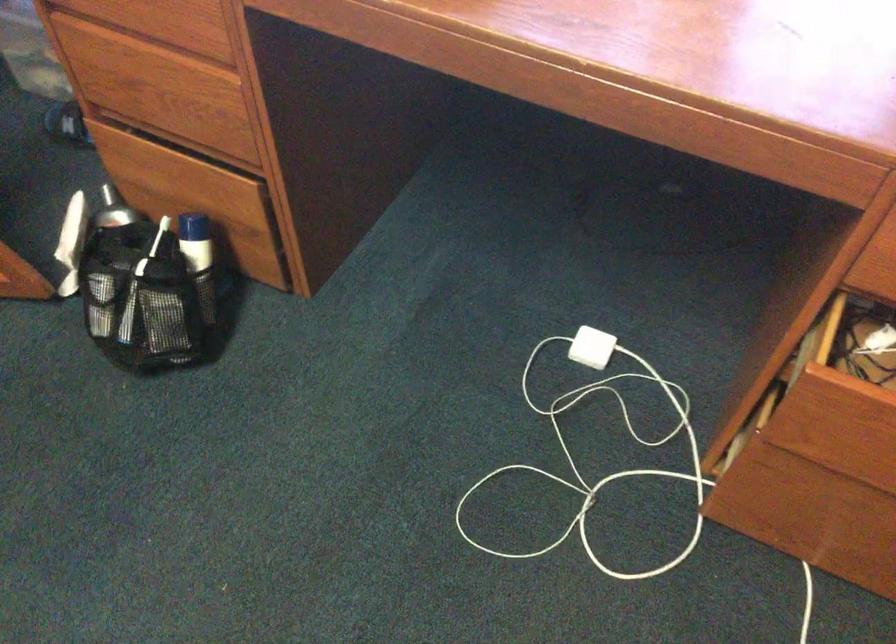
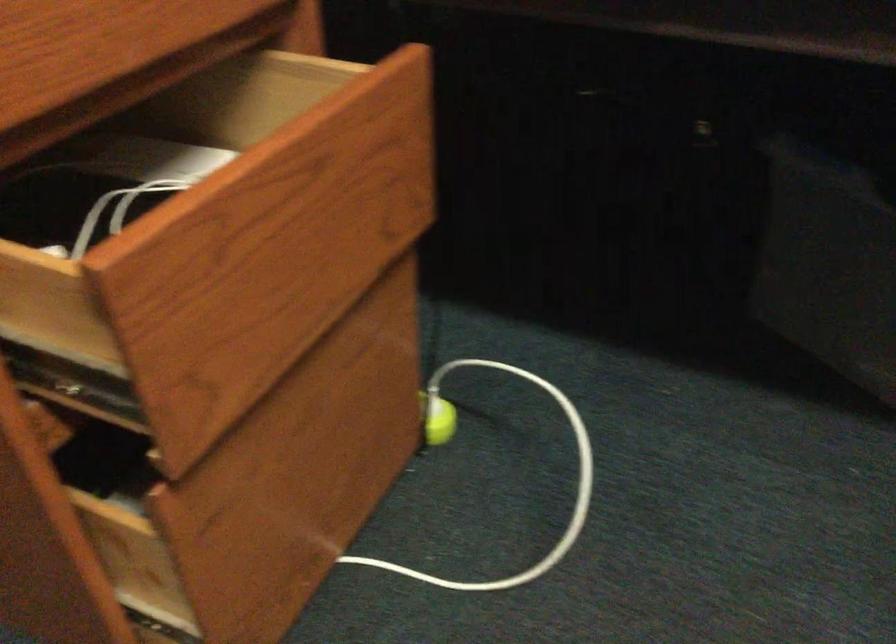
First-person continuous shooting, in which direction is the camera rotating?

The camera's rotation is toward right-down.